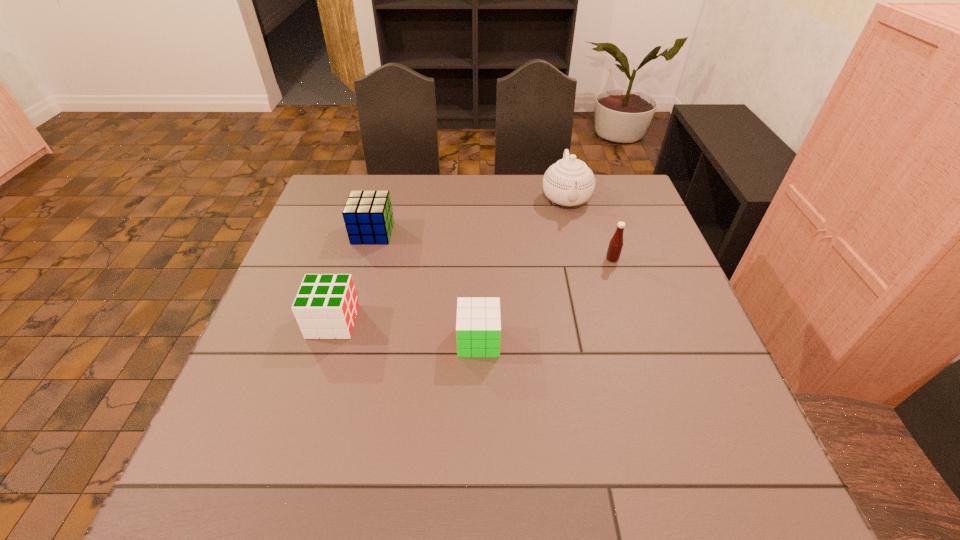
Where is `the farthest object`? The image size is (960, 540). the farthest object is located at coordinates (569, 182).

Locate an element on the screen. The width and height of the screenshot is (960, 540). the tallest object is located at coordinates (569, 182).

The height and width of the screenshot is (540, 960). I want to click on the third nearest object, so click(x=615, y=246).

Locate an element on the screen. The height and width of the screenshot is (540, 960). the fourth nearest object is located at coordinates (368, 217).

This screenshot has height=540, width=960. Find the location of `the third object from left to right`. the third object from left to right is located at coordinates (478, 321).

This screenshot has width=960, height=540. Identify the location of vacant space situated 0.130m on the spout of the farthest object. (578, 248).

This screenshot has height=540, width=960. I want to click on free space located 0.260m on the back of the third farthest object, so click(x=593, y=200).

This screenshot has width=960, height=540. In order to click on vacant space located 0.230m on the right of the fourth nearest object in this screenshot , I will do `click(472, 233)`.

Where is `vacant space situated 0.190m on the left of the third object from right to left`? This screenshot has width=960, height=540. vacant space situated 0.190m on the left of the third object from right to left is located at coordinates (373, 341).

You are a GUI agent. You are given a task and a screenshot of the screen. Output one action in this format:
    pyautogui.click(x=<x>, y=<y>)
    Task: Click on the object positioned at the far edge
    
    Given the screenshot: What is the action you would take?
    pyautogui.click(x=569, y=182)